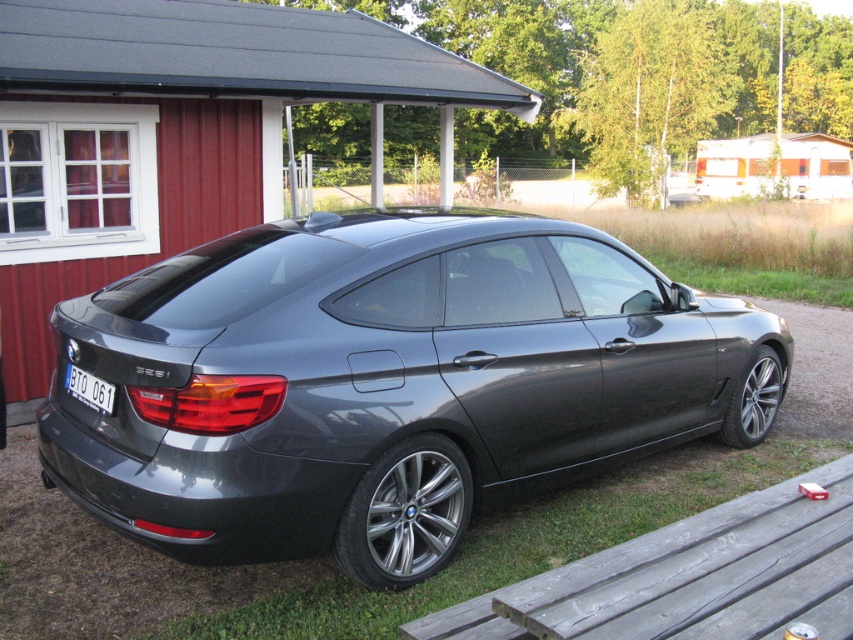
Question: Does red wood hut at upper left have a lesser width compared to white plastic license plate at rear?

Choices:
 (A) yes
 (B) no

Answer: (B)

Question: Which of the following is the closest to the observer?

Choices:
 (A) (103, 392)
 (B) (126, 218)
 (C) (178, 456)
 (D) (743, 141)

Answer: (C)

Question: Is satin metallic car at center smaller than red wood hut at upper left?

Choices:
 (A) yes
 (B) no

Answer: (A)

Question: Considering the real-world distances, which object is farthest from the satin metallic car at center?

Choices:
 (A) white wood trailer at upper right
 (B) white plastic license plate at rear
 (C) red wood hut at upper left

Answer: (A)

Question: Which of the following is the closest to the observer?

Choices:
 (A) white wood trailer at upper right
 (B) white plastic license plate at rear

Answer: (B)

Question: Is white wood trailer at upper right to the right of white plastic license plate at rear from the viewer's perspective?

Choices:
 (A) yes
 (B) no

Answer: (A)